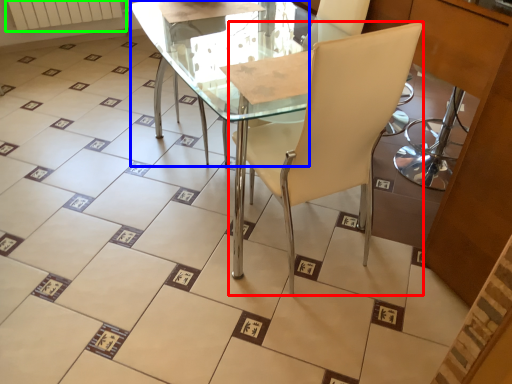
Question: Which object is positioned farthest from chair (highlighted by a red box)? Select from round table (highlighted by a blue box) and radiator (highlighted by a green box).

Choices:
 (A) round table
 (B) radiator

Answer: (B)